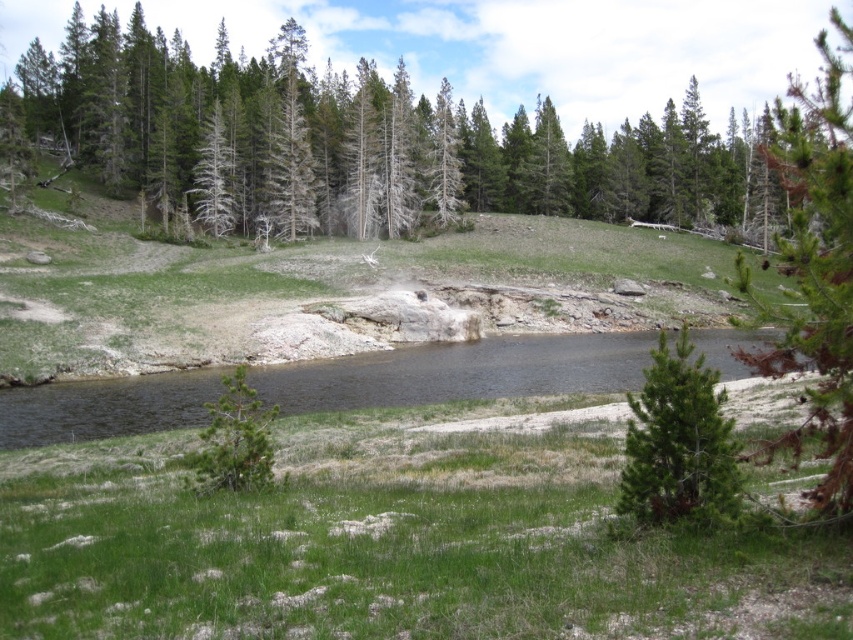
Question: Which point is farther to the camera?

Choices:
 (A) green matte tree at lower right
 (B) green textured tree at upper center
 (C) dark brown water at center
 (D) green matte tree at upper center

Answer: (B)

Question: Which point is closer to the camera?

Choices:
 (A) (576, 157)
 (B) (222, 401)
 (C) (90, 236)
 (D) (628, 356)

Answer: (B)

Question: Is green needle-like at right below green matte tree at center?

Choices:
 (A) no
 (B) yes

Answer: (A)

Question: Which point is farther from the camera taking this photo?

Choices:
 (A) (564, 353)
 (B) (679, 346)
 (C) (28, 355)
 (D) (186, 484)

Answer: (A)

Question: Can you confirm if dark brown water at center is positioned below green needle-like at right?

Choices:
 (A) no
 (B) yes

Answer: (B)

Question: Is green grassy hillside at center to the left of green needle-like at right from the viewer's perspective?

Choices:
 (A) yes
 (B) no

Answer: (A)